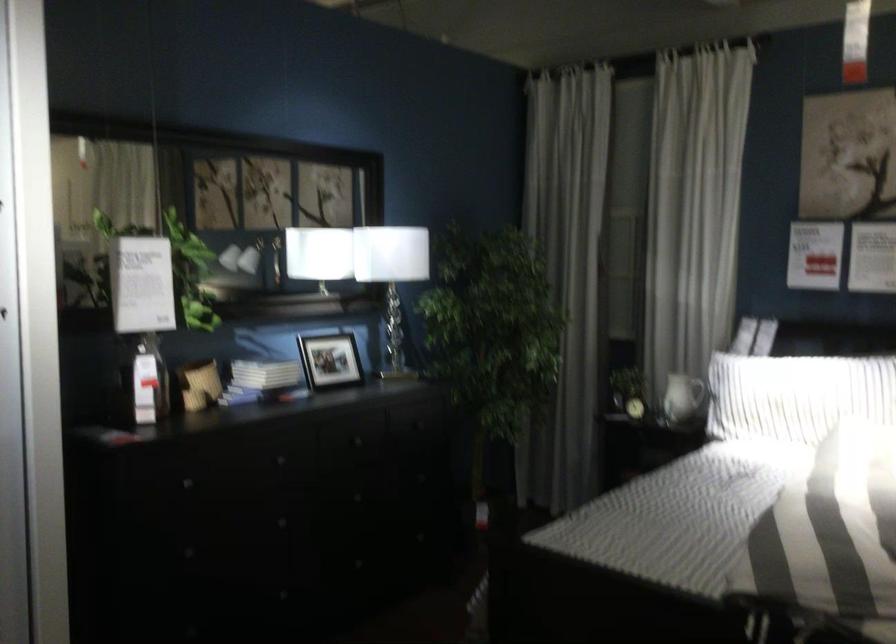
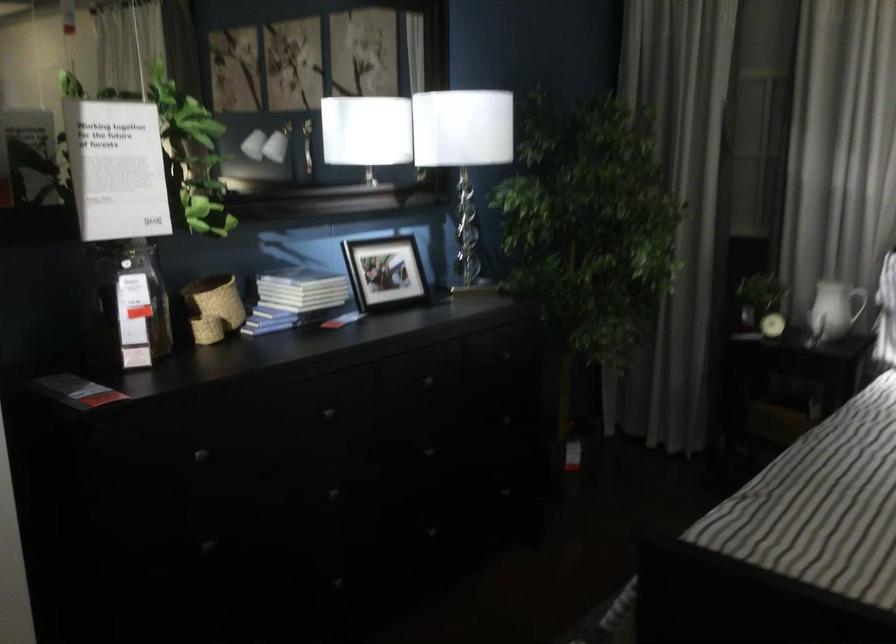
Question: What movement of the cameraman would produce the second image?

Choices:
 (A) Left
 (B) Right
 (C) Forward
 (D) Backward

Answer: (C)